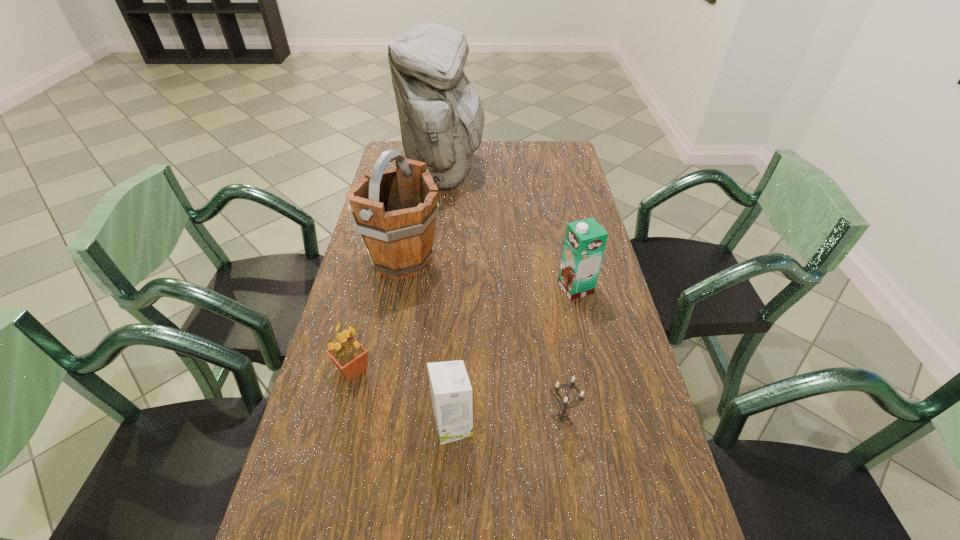
Find the location of a particular element. The image size is (960, 540). the tallest object is located at coordinates (441, 116).

This screenshot has width=960, height=540. I want to click on the farthest object, so click(x=441, y=116).

I want to click on bucket, so click(394, 210).

The width and height of the screenshot is (960, 540). I want to click on the right carton, so click(585, 240).

Locate an element on the screen. The height and width of the screenshot is (540, 960). the farther carton is located at coordinates (585, 240).

At what (x,y) coordinates should I click in order to perform the action: click on the nearer carton. Please return your answer as a coordinate pair (x, y). The height and width of the screenshot is (540, 960). Looking at the image, I should click on (452, 399).

What are the coordinates of `the shorter carton` in the screenshot? It's located at (452, 399).

This screenshot has height=540, width=960. Find the location of `sunflower`. sunflower is located at coordinates (350, 357).

At what (x,y) coordinates should I click in order to perform the action: click on the second shortest object. Please return your answer as a coordinate pair (x, y). Image resolution: width=960 pixels, height=540 pixels. Looking at the image, I should click on (350, 357).

Where is `the shortest object`? the shortest object is located at coordinates (562, 415).